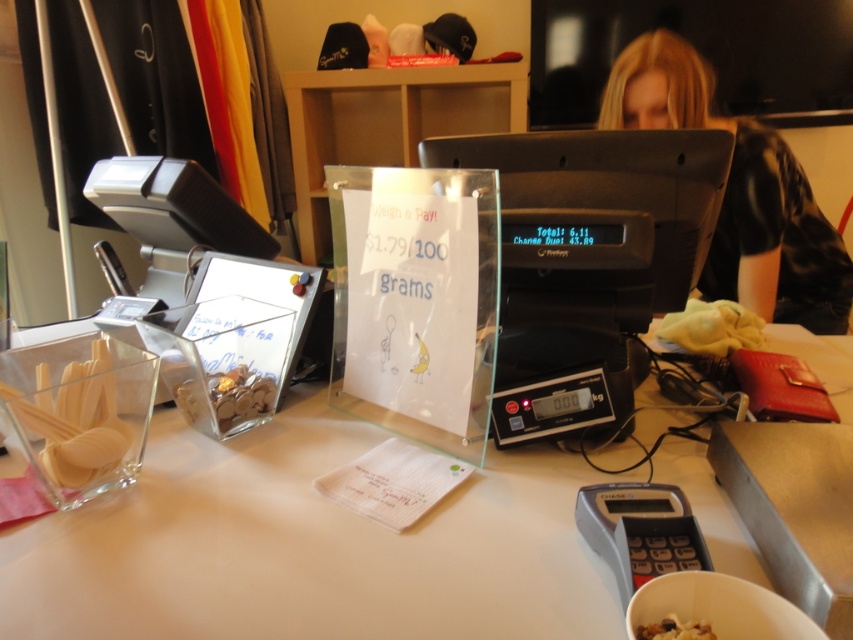
You are a customer at the checkout counter. You see the black plastic scale at center and the translucent plastic bag of nuts at center. Which object is located to the left of the other?

The translucent plastic bag of nuts at center is located to the left of the black plastic scale at center because the black plastic scale at center is positioned on the right side of the translucent plastic bag of nuts at center.

Looking at this image, you are a customer at this checkout counter and need to locate the blonde hair at upper right. Where exactly should you look relative to the weighing scale?

The blonde hair at upper right is located at the coordinates point (740, 193) relative to the weighing scale.